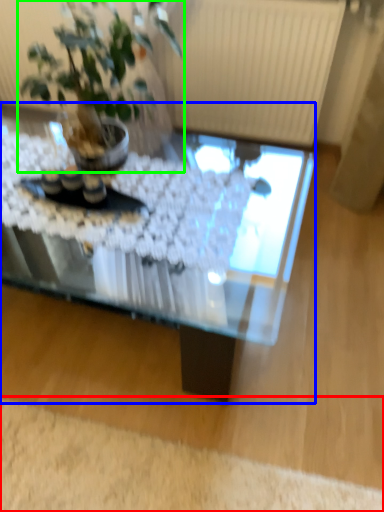
Question: Which object is the farthest from plain (highlighted by a red box)? Choose among these: coffee table (highlighted by a blue box) or houseplant (highlighted by a green box).

Choices:
 (A) coffee table
 (B) houseplant

Answer: (B)